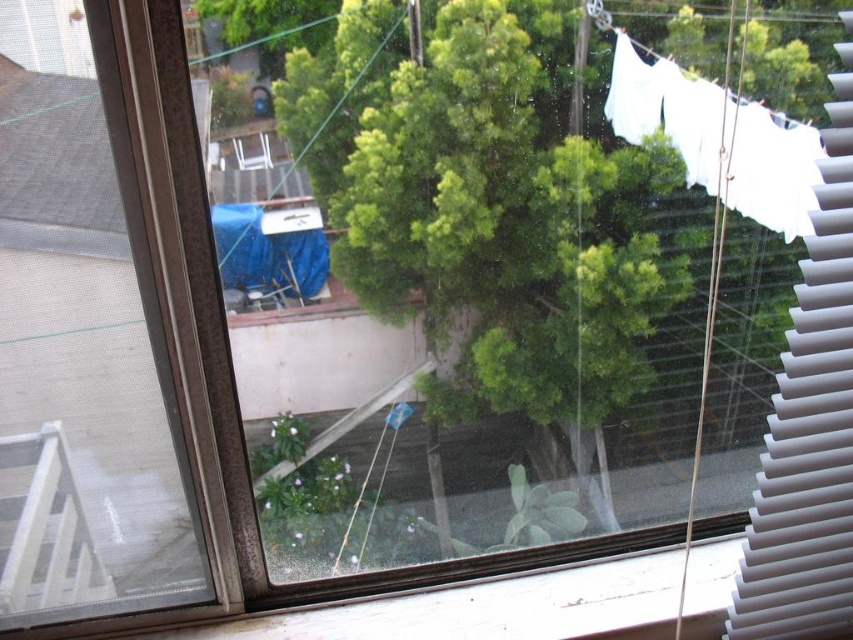
You are looking through the window and notice the white plastic blinds at right and the white fabric clothesline at upper right. Which object is closer to you, the observer?

The white plastic blinds at right is closer to you because it is in front of the white fabric clothesline at upper right.

You are standing 3 feet away from the window. Can you reach the white plastic blinds at right without moving your position?

The distance between you and the white plastic blinds at right is 37.00 inches, which is approximately 3.08 feet. Since you are standing 3 feet away, you can just barely reach the white plastic blinds at right without moving.